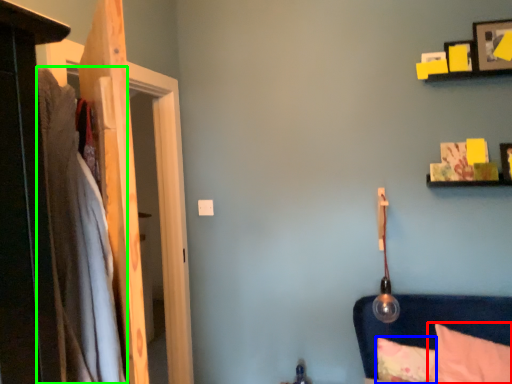
Question: Which is nearer to the pillow (highlighted by a red box)? pillow (highlighted by a blue box) or blanket (highlighted by a green box).

Choices:
 (A) pillow
 (B) blanket

Answer: (A)